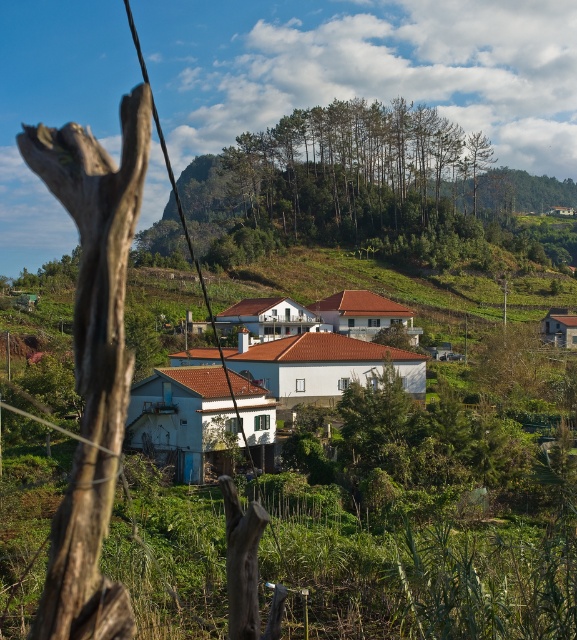
Does green leafy trees at upper center have a lesser width compared to black wire at left?

Indeed, green leafy trees at upper center has a lesser width compared to black wire at left.

Does green leafy trees at upper center have a greater width compared to black wire at left?

In fact, green leafy trees at upper center might be narrower than black wire at left.

What do you see at coordinates (353, 168) in the screenshot? I see `green leafy trees at upper center` at bounding box center [353, 168].

The height and width of the screenshot is (640, 577). I want to click on green leafy trees at upper center, so click(x=353, y=168).

Is white matte house at center closer to camera compared to black wire at left?

No.

Between white matte house at center and black wire at left, which one appears on the left side from the viewer's perspective?

From the viewer's perspective, black wire at left appears more on the left side.

The height and width of the screenshot is (640, 577). Find the location of `white matte house at center`. white matte house at center is located at coordinates (306, 374).

Does green leafy trees at upper center have a lesser width compared to white matte house at center?

No, green leafy trees at upper center is not thinner than white matte house at center.

Is point (302, 227) positioned after point (226, 380)?

Yes, point (302, 227) is behind point (226, 380).

Where is `green leafy trees at upper center`? This screenshot has height=640, width=577. green leafy trees at upper center is located at coordinates (353, 168).